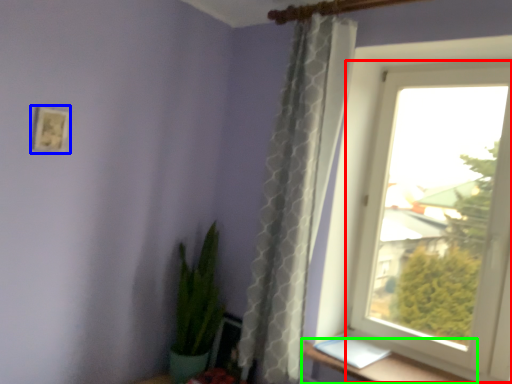
Question: Based on their relative distances, which object is farther from window (highlighted by a red box)? Choose from picture frame (highlighted by a blue box) and window sill (highlighted by a green box).

Choices:
 (A) picture frame
 (B) window sill

Answer: (A)